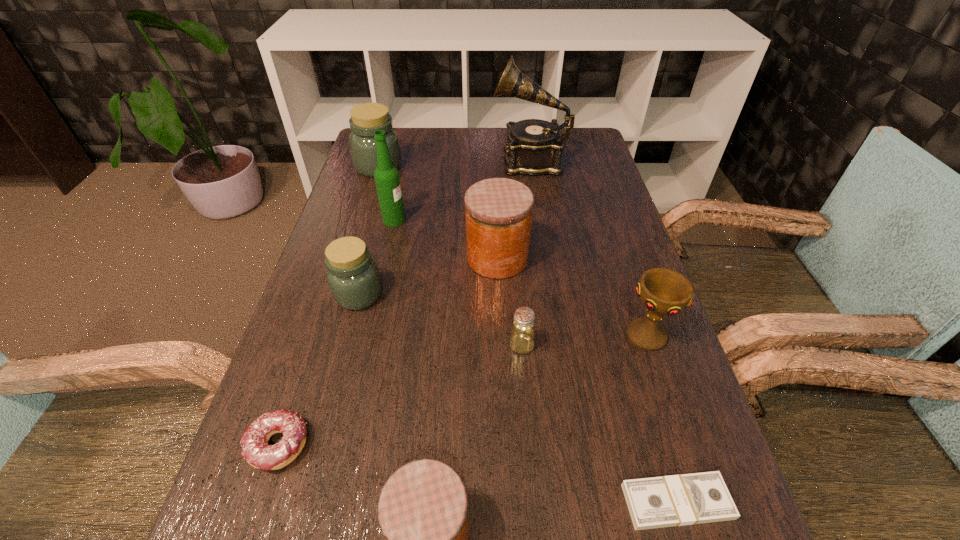
At what (x,y) coordinates should I click in order to perform the action: click on vacant space that satisfies the following two spatial constraints: 1. on the back side of the shortest object; 2. on the horn of the phonograph record. Please return your answer as a coordinate pair (x, y). The width and height of the screenshot is (960, 540). Looking at the image, I should click on click(x=576, y=160).